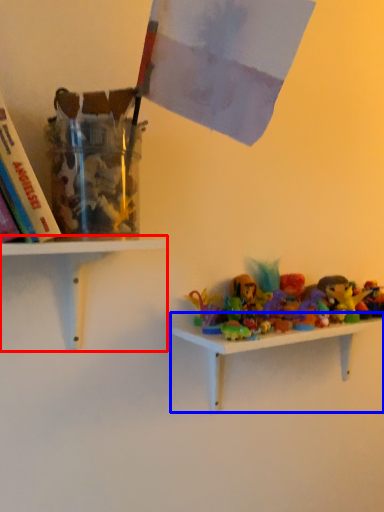
Question: Which point is further to the camera, shelf (highlighted by a red box) or shelf (highlighted by a blue box)?

Choices:
 (A) shelf
 (B) shelf

Answer: (B)